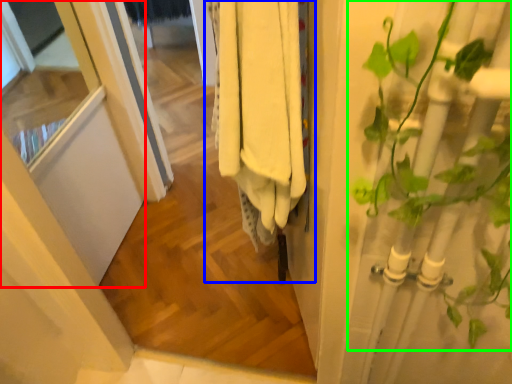
Question: Considering the real-world distances, which object is closest to screen door (highlighted by a red box)? closet (highlighted by a blue box) or houseplant (highlighted by a green box).

Choices:
 (A) closet
 (B) houseplant

Answer: (A)